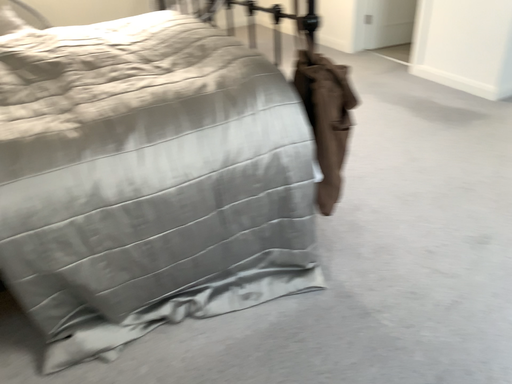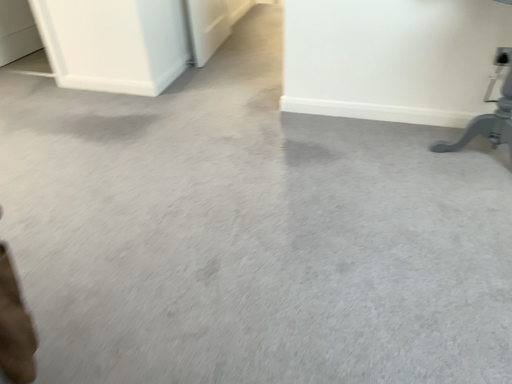
Question: How did the camera likely rotate when shooting the video?

Choices:
 (A) rotated left
 (B) rotated right

Answer: (B)